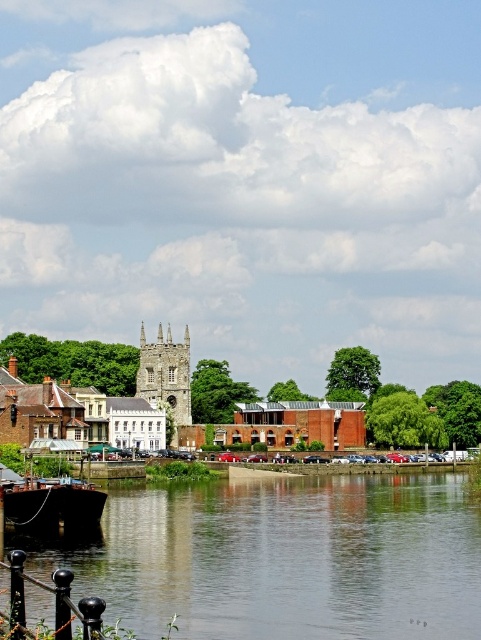
Does smooth concrete river at lower center have a greater height compared to brown brick building at center?

In fact, smooth concrete river at lower center may be shorter than brown brick building at center.

Is smooth concrete river at lower center positioned at the back of brown brick building at center?

No, it is not.

Is point (111, 561) less distant than point (435, 397)?

Yes, point (111, 561) is in front of point (435, 397).

The image size is (481, 640). Identify the location of smooth concrete river at lower center. (288, 557).

Is smooth concrete river at lower center shorter than stone tower at center?

Yes, smooth concrete river at lower center is shorter than stone tower at center.

Describe the element at coordinates (288, 557) in the screenshot. The image size is (481, 640). I see `smooth concrete river at lower center` at that location.

Find the location of a particular element. smooth concrete river at lower center is located at coordinates (288, 557).

Is point (50, 516) positioned in front of point (143, 364)?

Yes.

Between point (81, 486) and point (188, 328), which one is positioned behind?

The point (188, 328) is behind.

Does point (86, 490) come closer to viewer compared to point (151, 385)?

That is True.

I want to click on dark brown wooden boat at lower left, so click(x=51, y=508).